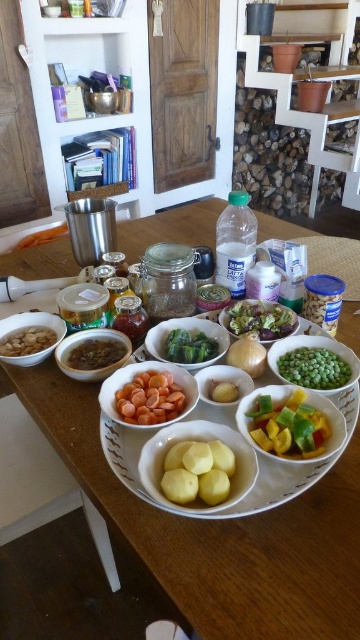
Who is higher up, matte white bowl at center-left or brown paste at center?

matte white bowl at center-left is higher up.

Is matte white bowl at center-left shorter than brown paste at center?

In fact, matte white bowl at center-left may be taller than brown paste at center.

Who is more forward, (47, 332) or (125, 346)?

Point (125, 346)

This screenshot has height=640, width=360. Find the location of `matte white bowl at center-left`. matte white bowl at center-left is located at coordinates (29, 337).

Which of these two, white glossy platter at center or yellow matte potatoes at center, stands shorter?

yellow matte potatoes at center is shorter.

Is white glossy platter at center wider than yellow matte potatoes at center?

Indeed, white glossy platter at center has a greater width compared to yellow matte potatoes at center.

Who is more distant from viewer, (x=345, y=401) or (x=177, y=480)?

Positioned behind is point (x=345, y=401).

Identify the location of white glossy platter at center. Image resolution: width=360 pixels, height=640 pixels. (291, 468).

What do you see at coordinates (92, 353) in the screenshot? Image resolution: width=360 pixels, height=640 pixels. I see `matte brown soup at center-left` at bounding box center [92, 353].

Which is more to the right, matte brown soup at center-left or brown matte nuts at left?

Positioned to the right is matte brown soup at center-left.

Which is in front, point (72, 358) or point (38, 352)?

Point (72, 358) is more forward.

Where is `matte brown soup at center-left`? This screenshot has height=640, width=360. matte brown soup at center-left is located at coordinates (92, 353).